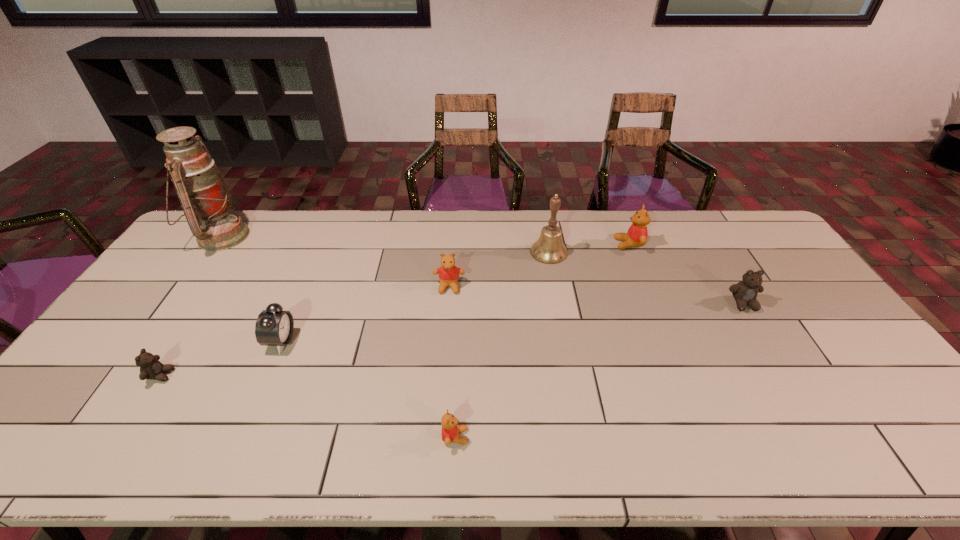
I want to click on object that is positioned at the far left corner, so click(205, 198).

The image size is (960, 540). What are the coordinates of `free space at the far edge` in the screenshot? It's located at coord(534,213).

The image size is (960, 540). I want to click on blank space at the near edge, so [x=757, y=440].

The width and height of the screenshot is (960, 540). I want to click on blank space at the left edge of the desktop, so click(x=121, y=334).

You are a GUI agent. You are given a task and a screenshot of the screen. Output one action in this format:
    pyautogui.click(x=<x>, y=<y>)
    Task: Click on the vacant space at the far left corner
    The image size is (960, 540).
    Given the screenshot: What is the action you would take?
    pyautogui.click(x=244, y=219)

Locate an element on the screen. free space between the second nearest red teddy bear and the third object from left to right is located at coordinates (365, 314).

Image resolution: width=960 pixels, height=540 pixels. What are the coordinates of `free spot between the biggest red teddy bear and the farther brown teddy bear` in the screenshot? It's located at (686, 274).

Locate an element on the screen. The width and height of the screenshot is (960, 540). unoccupied position between the farthest teddy bear and the nearer brown teddy bear is located at coordinates (395, 309).

The width and height of the screenshot is (960, 540). Find the location of `empty location between the red oil lamp and the second tallest object`. empty location between the red oil lamp and the second tallest object is located at coordinates (385, 244).

Image resolution: width=960 pixels, height=540 pixels. What are the coordinates of `vacant space that is in between the sixth farthest object and the bell` in the screenshot? It's located at (415, 296).